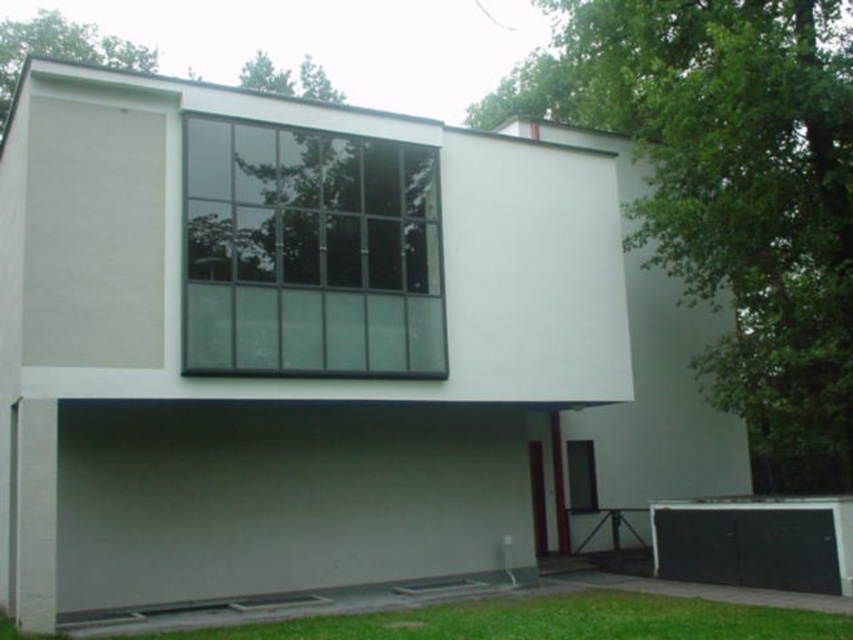
Question: Is transparent glass window at center wider than black matte garage door at lower right?

Choices:
 (A) yes
 (B) no

Answer: (A)

Question: Is transparent glass window at center bigger than black matte garage door at lower right?

Choices:
 (A) no
 (B) yes

Answer: (B)

Question: Which point is farther to the camera?

Choices:
 (A) black matte garage door at lower right
 (B) transparent glass window at center

Answer: (A)

Question: Can you confirm if transparent glass window at center is thinner than black matte garage door at lower right?

Choices:
 (A) no
 (B) yes

Answer: (A)